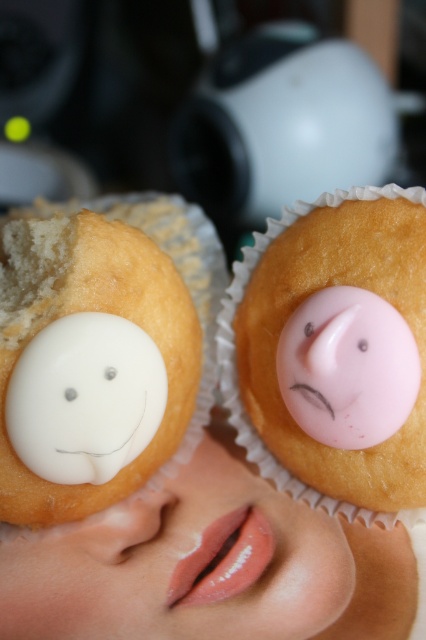
You are a baker checking the cupcakes. You need to know which frosting part is taller between the pink glossy frosting at right and the white matte eye at center. Which one is taller?

The pink glossy frosting at right has a greater height compared to the white matte eye at center, so the pink glossy frosting at right is taller.